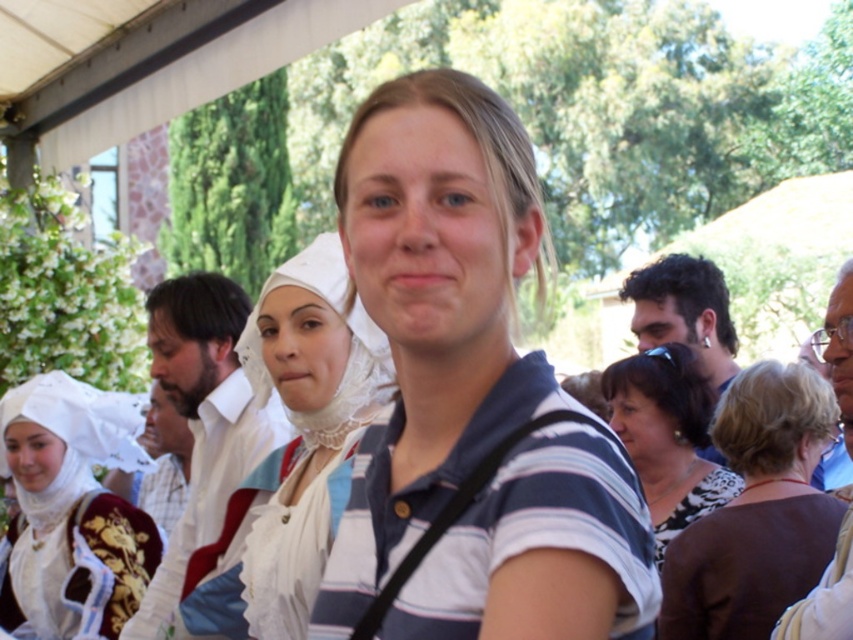
Is brown fabric at center positioned behind dark brown hair at right?

No, brown fabric at center is closer to the viewer.

What do you see at coordinates (756, 512) in the screenshot?
I see `brown fabric at center` at bounding box center [756, 512].

Where is `brown fabric at center`? The width and height of the screenshot is (853, 640). brown fabric at center is located at coordinates [x=756, y=512].

What do you see at coordinates (202, 420) in the screenshot?
I see `white fabric shirt at center` at bounding box center [202, 420].

Who is positioned more to the left, white fabric shirt at center or blue striped shirt at center?

white fabric shirt at center

Is point (252, 429) positioned behind point (850, 257)?

No, it is in front of (850, 257).

I want to click on white fabric shirt at center, so click(x=202, y=420).

Does point (701, 500) come behind point (189, 445)?

No, (701, 500) is closer to viewer.

Image resolution: width=853 pixels, height=640 pixels. What do you see at coordinates (666, 435) in the screenshot?
I see `matte white blouse at center` at bounding box center [666, 435].

Where is `matte white blouse at center`? The image size is (853, 640). matte white blouse at center is located at coordinates (666, 435).

Locate an element on the screen. Image resolution: width=853 pixels, height=640 pixels. matte white blouse at center is located at coordinates (666, 435).